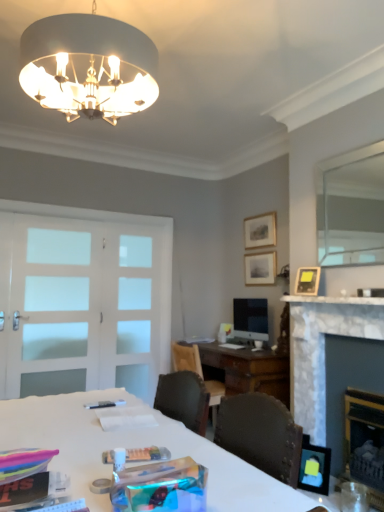
I want to click on vacant area on top of white glossy desk at center (from a real-world perspective), so click(x=109, y=431).